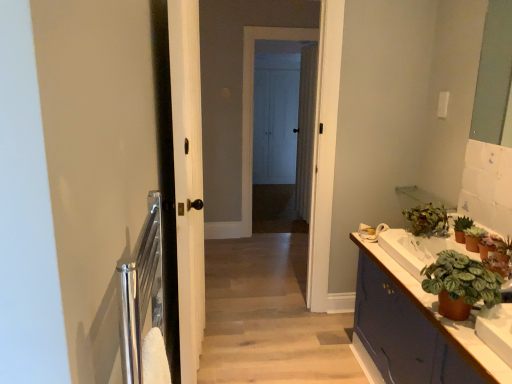
Identify the location of vacant space underneath green matte plant at right, arranged as the 1th houseplant when viewed from the front (from a real-world perspective). (458, 320).